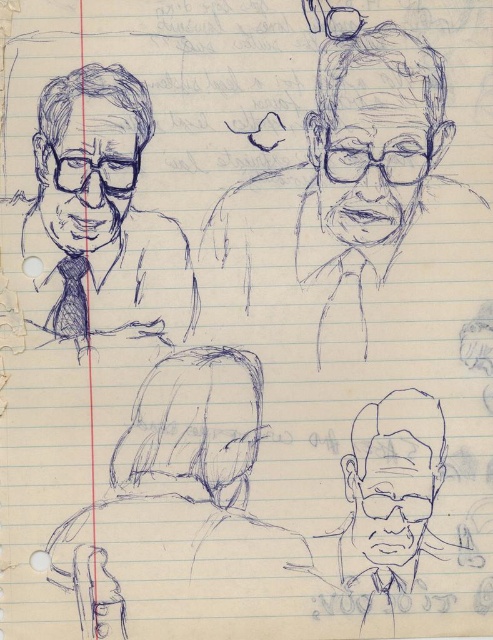
Based on the photo, can you confirm if smooth gray head at center is positioned to the right of smooth black pen sketch of head at upper left?

Yes, smooth gray head at center is to the right of smooth black pen sketch of head at upper left.

Between point (253, 449) and point (141, 106), which one is positioned in front?

Point (141, 106) is in front.

This screenshot has width=493, height=640. In order to click on smooth gray head at center in this screenshot , I will do `click(196, 422)`.

From the picture: Can you confirm if matte black head at lower right is positioned below smooth black pen sketch of head at upper left?

Correct, matte black head at lower right is located below smooth black pen sketch of head at upper left.

At what (x,y) coordinates should I click in order to perform the action: click on matte black head at lower right. Please return your answer as a coordinate pair (x, y). Image resolution: width=493 pixels, height=640 pixels. Looking at the image, I should click on (393, 476).

Is blue ink drawing of man at upper right taller than graphite pencil sketch of head at upper right?

Correct, blue ink drawing of man at upper right is much taller as graphite pencil sketch of head at upper right.

Who is shorter, blue ink drawing of man at upper right or graphite pencil sketch of head at upper right?

With less height is graphite pencil sketch of head at upper right.

Where is `blue ink drawing of man at upper right`? The height and width of the screenshot is (640, 493). blue ink drawing of man at upper right is located at coordinates (364, 154).